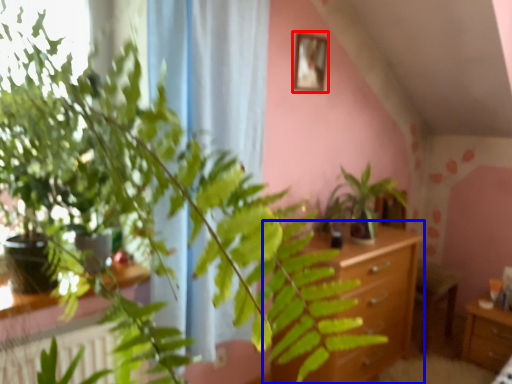
Question: Which object is closer to the camera taking this photo, picture frame (highlighted by a red box) or vanity (highlighted by a blue box)?

Choices:
 (A) picture frame
 (B) vanity

Answer: (B)